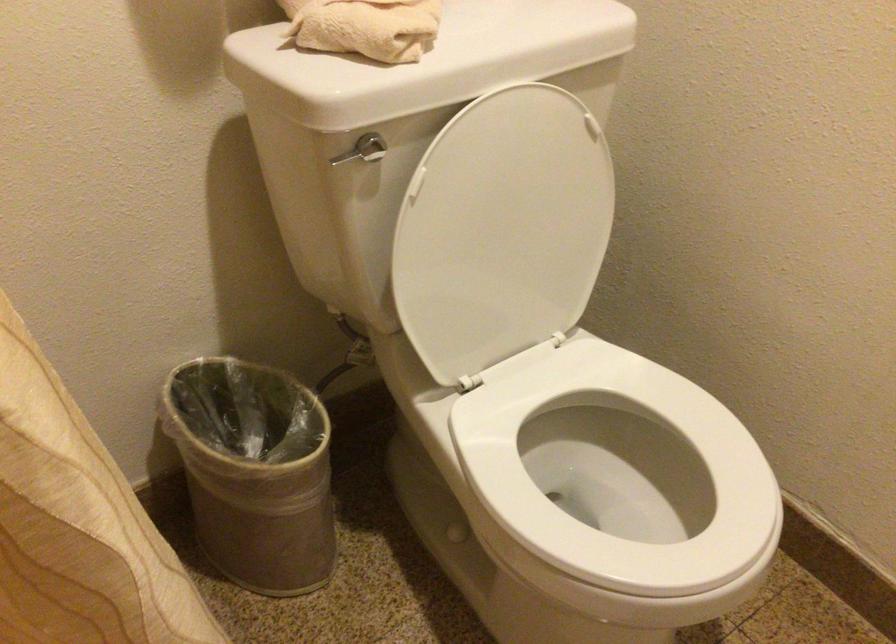
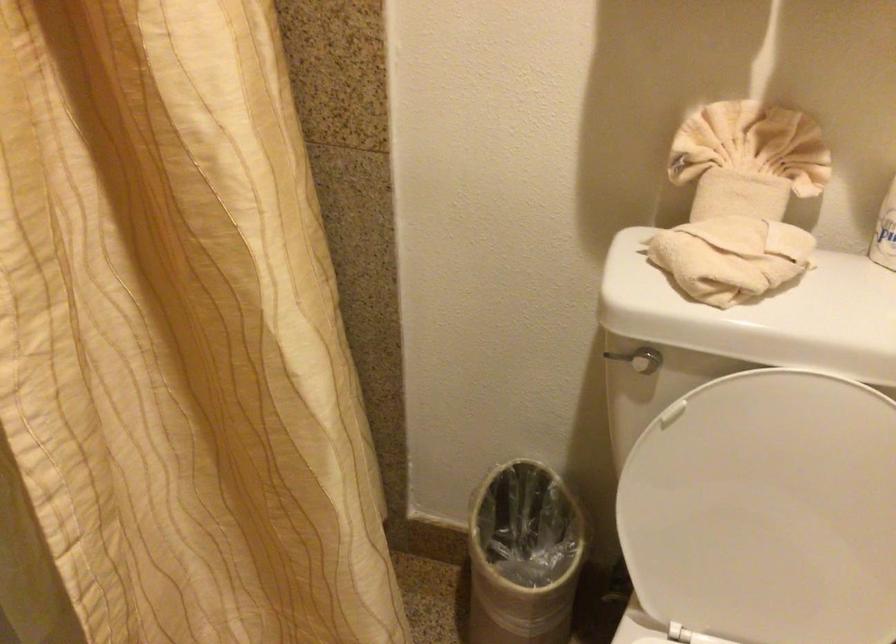
Locate, in the second image, the point that corresponds to (x=242, y=457) in the first image.

(522, 556)